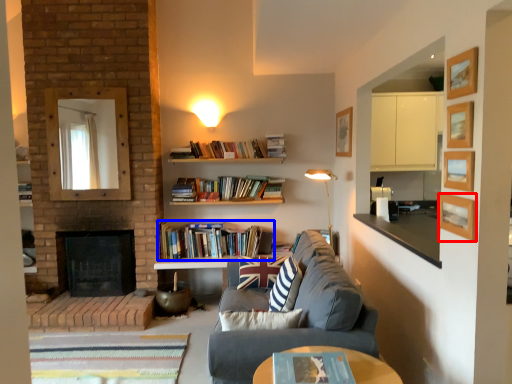
Question: Among these objects, which one is farthest to the camera, picture frame (highlighted by a red box) or book (highlighted by a blue box)?

Choices:
 (A) picture frame
 (B) book

Answer: (B)